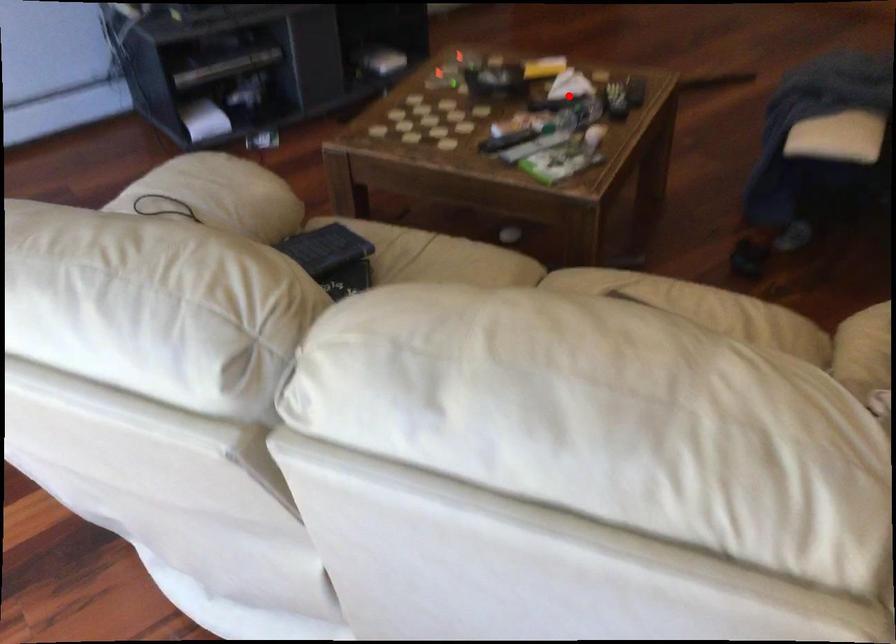
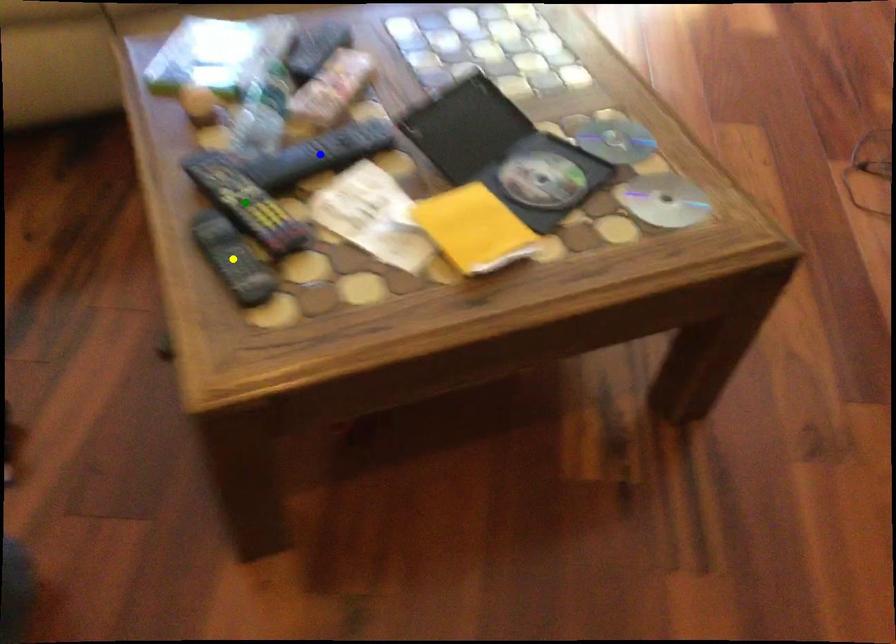
Question: I am providing you with two images of the same scene from different viewpoints. A red point is marked on the first image. You are given multiple points on the second image. Which spot in image 2 lines up with the point in image 1?

Choices:
 (A) green point
 (B) yellow point
 (C) blue point

Answer: (C)